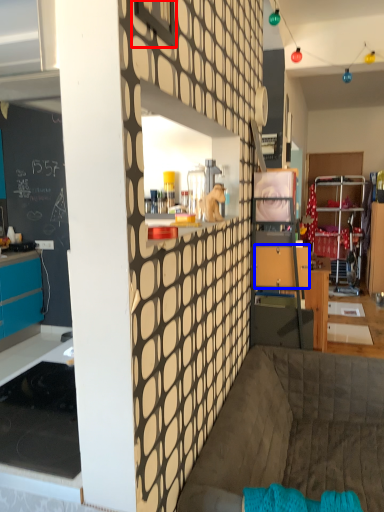
Question: Which point is closer to the camera, window (highlighted by a red box) or drawer (highlighted by a blue box)?

Choices:
 (A) window
 (B) drawer

Answer: (A)